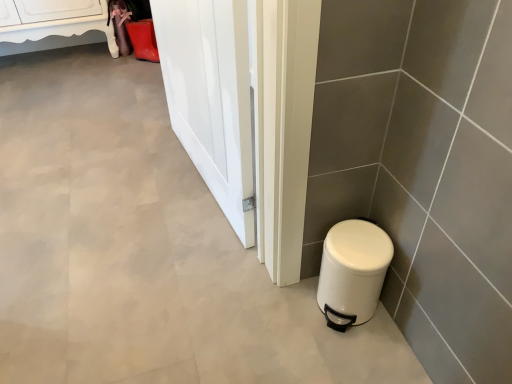
Question: Considering the relative sizes of white glossy door at center and white glossy cabinet at upper left in the image provided, is white glossy door at center wider than white glossy cabinet at upper left?

Choices:
 (A) no
 (B) yes

Answer: (A)

Question: Is white glossy door at center smaller than white glossy cabinet at upper left?

Choices:
 (A) no
 (B) yes

Answer: (B)

Question: Is white glossy door at center positioned with its back to white glossy cabinet at upper left?

Choices:
 (A) no
 (B) yes

Answer: (A)

Question: From a real-world perspective, is white glossy door at center on top of white glossy cabinet at upper left?

Choices:
 (A) yes
 (B) no

Answer: (A)

Question: Is white glossy door at center further to the viewer compared to white glossy cabinet at upper left?

Choices:
 (A) yes
 (B) no

Answer: (B)

Question: In terms of size, does white glossy door at center appear bigger or smaller than white matte trash can at lower right?

Choices:
 (A) small
 (B) big

Answer: (B)

Question: Choose the correct answer: Is white glossy door at center inside white matte trash can at lower right or outside it?

Choices:
 (A) inside
 (B) outside

Answer: (B)

Question: From the image's perspective, is white glossy door at center located above or below white matte trash can at lower right?

Choices:
 (A) below
 (B) above

Answer: (B)

Question: Considering the positions of point (234, 129) and point (340, 268), is point (234, 129) closer or farther from the camera than point (340, 268)?

Choices:
 (A) farther
 (B) closer

Answer: (A)

Question: In terms of width, does white matte trash can at lower right look wider or thinner when compared to white glossy door at center?

Choices:
 (A) wide
 (B) thin

Answer: (A)

Question: Relative to white glossy door at center, is white matte trash can at lower right in front or behind?

Choices:
 (A) behind
 (B) front

Answer: (A)

Question: Based on their positions, is white matte trash can at lower right located to the left or right of white glossy door at center?

Choices:
 (A) right
 (B) left

Answer: (A)

Question: From a real-world perspective, relative to white glossy door at center, is white matte trash can at lower right vertically above or below?

Choices:
 (A) above
 (B) below

Answer: (B)

Question: Is white matte trash can at lower right wider or thinner than white glossy cabinet at upper left?

Choices:
 (A) wide
 (B) thin

Answer: (B)

Question: Visually, is white matte trash can at lower right positioned to the left or to the right of white glossy cabinet at upper left?

Choices:
 (A) right
 (B) left

Answer: (A)